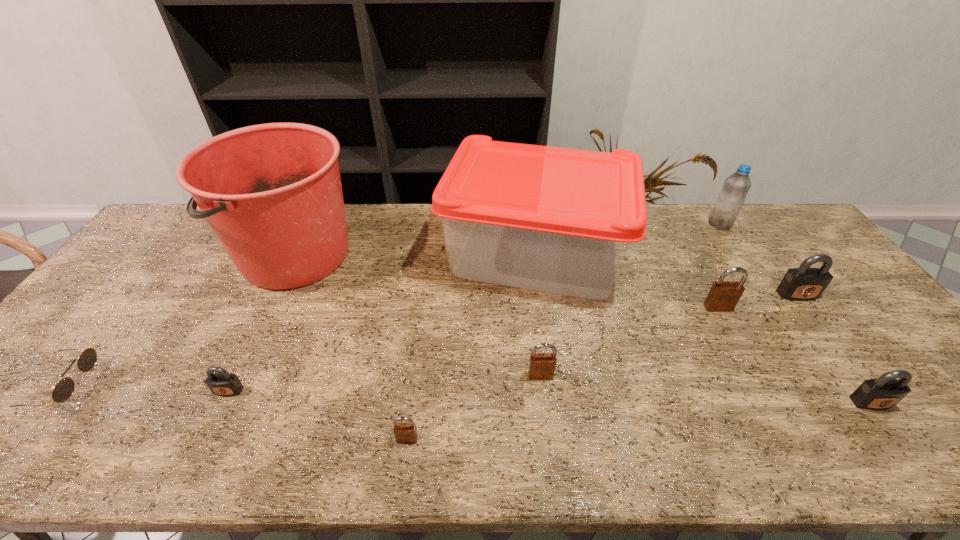
The image size is (960, 540). I want to click on water bottle at the far edge, so click(x=736, y=187).

Locate an element on the screen. The image size is (960, 540). object present at the near edge is located at coordinates (405, 433).

Locate an element on the screen. object present at the left edge is located at coordinates (63, 390).

Where is `free space at the far edge`? The image size is (960, 540). free space at the far edge is located at coordinates (401, 220).

In the image, there is a desktop. Where is `free space at the near edge`? The height and width of the screenshot is (540, 960). free space at the near edge is located at coordinates (144, 449).

This screenshot has width=960, height=540. What are the coordinates of `vacant space at the near left corner of the desktop` in the screenshot? It's located at (47, 430).

Image resolution: width=960 pixels, height=540 pixels. Identify the location of vacant space in between the shortest object and the bucket. tap(178, 321).

Where is `vacant area that lies between the ninth shortest object and the second brown padlock from right to left`? Image resolution: width=960 pixels, height=540 pixels. vacant area that lies between the ninth shortest object and the second brown padlock from right to left is located at coordinates (538, 314).

I want to click on vacant space in between the second smallest gray padlock and the fourth nearest padlock, so click(706, 389).

Locate an element on the screen. The image size is (960, 540). empty location between the second smallest gray padlock and the second farthest padlock is located at coordinates (795, 355).